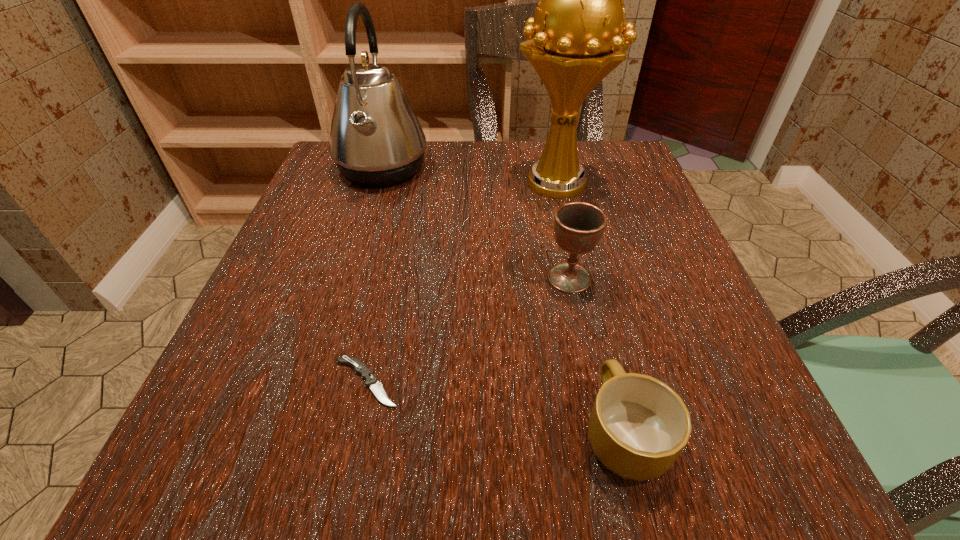
You are a GUI agent. You are given a task and a screenshot of the screen. Output one action in this format:
    pyautogui.click(x=<x>, y=<y>)
    Task: Click on the free space that satisfies the following two spatial constraints: 1. from the spout of the fourth shortest object; 2. on the left side of the shortest object
    
    Given the screenshot: What is the action you would take?
    pyautogui.click(x=317, y=382)

What are the coordinates of `free space that satisfies the following two spatial constraints: 1. from the spout of the fourth shortest object; 2. on the side with the handle of the mug` in the screenshot? It's located at (301, 432).

The width and height of the screenshot is (960, 540). In order to click on free region that satisfies the following two spatial constraints: 1. from the spout of the second tallest object; 2. on the left side of the chalice in this screenshot , I will do `click(348, 278)`.

Identify the location of free space that satisfies the following two spatial constraints: 1. from the spout of the fourth shortest object; 2. on the left side of the third tallest object. The width and height of the screenshot is (960, 540). (348, 278).

This screenshot has width=960, height=540. What are the coordinates of `vacant region that satisfies the following two spatial constraints: 1. from the spout of the kettle; 2. on the left side of the shortest object` in the screenshot? It's located at (317, 382).

At what (x,y) coordinates should I click in order to perform the action: click on free space that satisfies the following two spatial constraints: 1. from the spout of the chalice; 2. on the right side of the second tallest object. Please return your answer as a coordinate pair (x, y). Looking at the image, I should click on (348, 278).